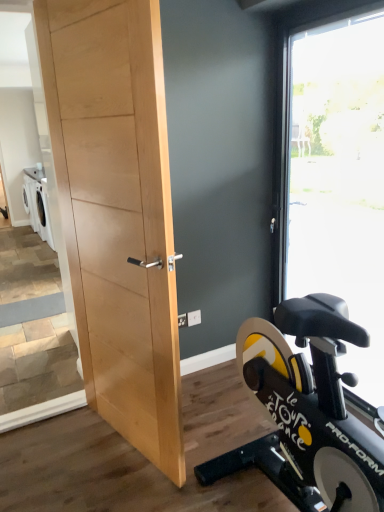
The image size is (384, 512). I want to click on free space to the left of natural wood door at center, so click(59, 454).